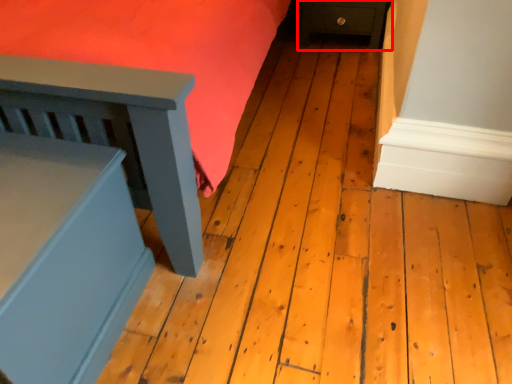
Question: From the image's perspective, what is the correct spatial positioning of furniture (annotated by the red box) in reference to furniture?

Choices:
 (A) above
 (B) below

Answer: (A)